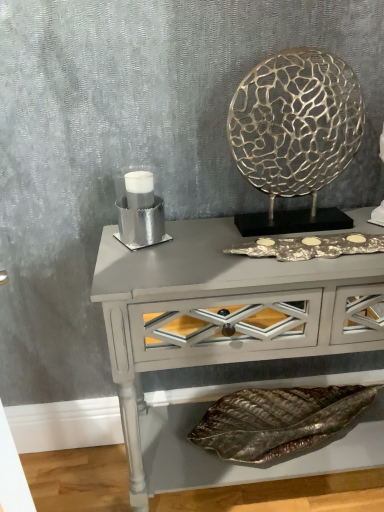
Find the location of a particular element. Image resolution: width=384 pixels, height=512 pixels. free area in between gold textured metal at upper right and silver metallic candle holder at left is located at coordinates (196, 234).